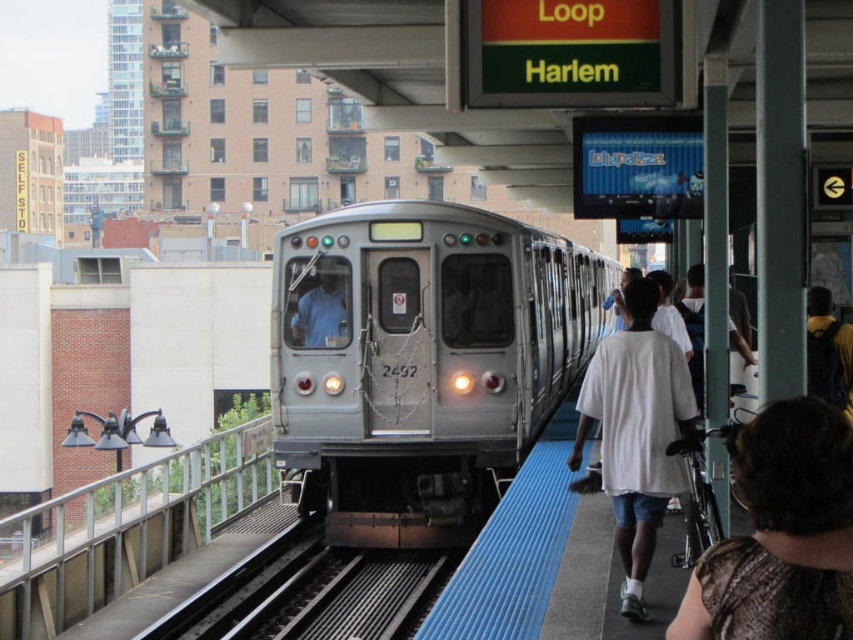
You are waiting at the train station platform. You see the silver metallic train at center and the dark brown textured shirt at lower right. Which object is closer to the edge of the platform?

The dark brown textured shirt at lower right is closer to the edge of the platform because the silver metallic train at center is positioned on the right side of it, implying the shirt is nearer to the platform edge.

You are a pedestrian standing on the platform at the train station. You see the silver metallic train at center and the white cotton shirt at right. If the train is approaching the platform at a speed of 15 km per hour, will you have enough time to safely walk to the blue tactile paving strip before the train arrives?

The silver metallic train at center is 8.22 meters from the white cotton shirt at right. Assuming the white cotton shirt at right represents your position, the train is approaching at 15 km per hour. Converting the speed to meters per second gives approximately 4.17 m per second. The distance to the blue tactile paving strip isnecessary to determine safety, but since the train is 8.22 meters away, it would take about 2 seconds to reach your position. You should immediately move to the blue tactile paving to

You are a photographer on the platform trying to capture both the dark brown textured shirt at lower right and the white cotton shirt at right in a single shot. Which person should you position closer to the camera to ensure both are in frame?

The dark brown textured shirt at lower right is thinner than the white cotton shirt at right. To include both in the frame, position the dark brown textured shirt at lower right closer to the camera since its narrower width requires less space compared to the wider white cotton shirt at right.